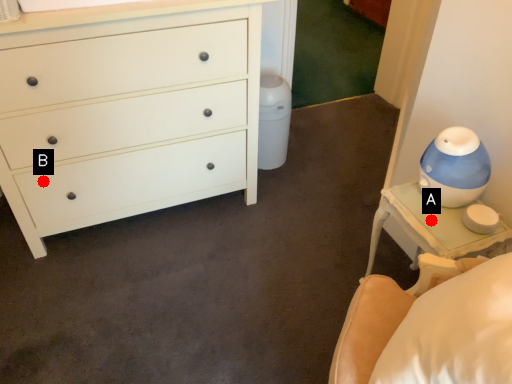
Question: Two points are circled on the image, labeled by A and B beside each circle. Which point appears farthest from the camera in this image?

Choices:
 (A) A is further
 (B) B is further

Answer: (B)